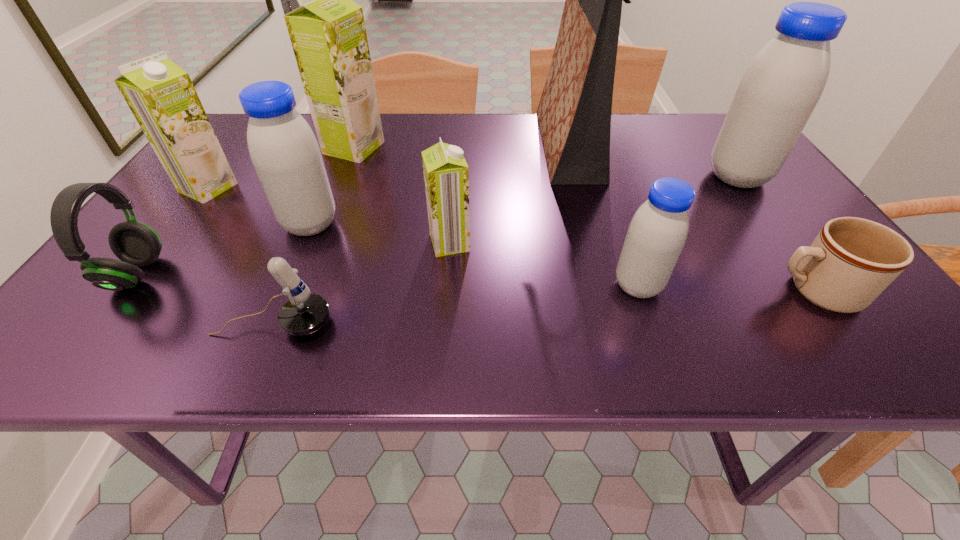
This screenshot has height=540, width=960. Identify the location of the tallest object. (574, 113).

Where is `the second green soya milk from right to left`? This screenshot has width=960, height=540. the second green soya milk from right to left is located at coordinates (328, 35).

Locate an element on the screen. the biggest green soya milk is located at coordinates (328, 35).

I want to click on the rightmost blue soya milk, so click(782, 85).

Where is `the farthest blue soya milk`? Image resolution: width=960 pixels, height=540 pixels. the farthest blue soya milk is located at coordinates (782, 85).

The width and height of the screenshot is (960, 540). What are the coordinates of `the second smallest green soya milk` in the screenshot? It's located at (160, 94).

The image size is (960, 540). I want to click on the second farthest green soya milk, so click(x=160, y=94).

Where is `the second smallest blue soya milk`? This screenshot has height=540, width=960. the second smallest blue soya milk is located at coordinates (285, 153).

This screenshot has height=540, width=960. I want to click on the leftmost blue soya milk, so click(x=285, y=153).

Where is `the third soya milk from right to left`? The image size is (960, 540). the third soya milk from right to left is located at coordinates (446, 174).